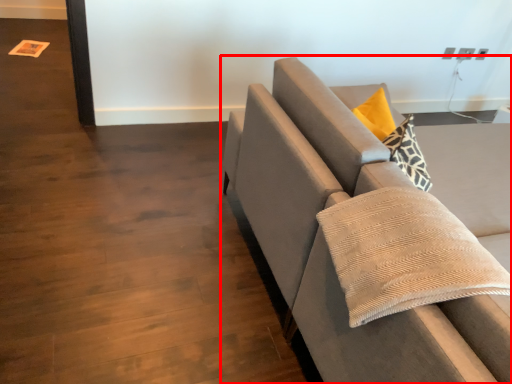
Question: Observing the image, what is the correct spatial positioning of studio couch (annotated by the red box) in reference to pillow?

Choices:
 (A) left
 (B) right

Answer: (B)